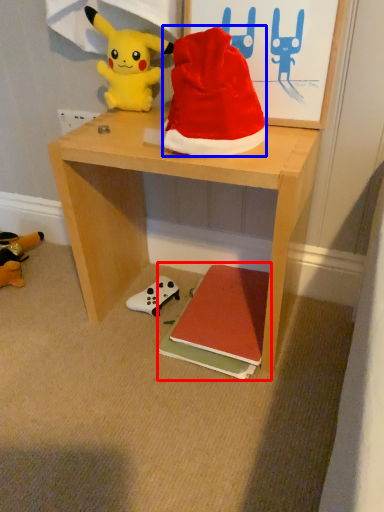
Question: Which point is closer to the camera, book (highlighted by a red box) or hat (highlighted by a blue box)?

Choices:
 (A) book
 (B) hat

Answer: (B)